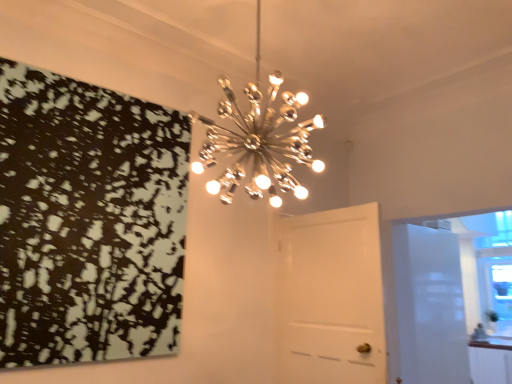
Question: From the image's perspective, is white glossy door at center, placed as the 1th door when sorted from front to back, positioned above or below white glossy cabinetry at lower right?

Choices:
 (A) below
 (B) above

Answer: (B)

Question: Considering the relative positions of white glossy door at center, the 2th door positioned from the back, and white glossy cabinetry at lower right in the image provided, is white glossy door at center, the 2th door positioned from the back, to the left or to the right of white glossy cabinetry at lower right?

Choices:
 (A) left
 (B) right

Answer: (A)

Question: Estimate the real-world distances between objects in this image. Which object is closer to the metallic starburst chandelier at upper center?

Choices:
 (A) white glossy door at center, the 2th door positioned from the back
 (B) black matte print at upper left
 (C) white glossy cabinetry at lower right
 (D) white glossy door at right, which is the first door in back-to-front order

Answer: (A)

Question: Estimate the real-world distances between objects in this image. Which object is closer to the white glossy door at center, the 1th door from the left?

Choices:
 (A) white glossy cabinetry at lower right
 (B) metallic starburst chandelier at upper center
 (C) black matte print at upper left
 (D) white glossy door at right, which appears as the 2th door when viewed from the left

Answer: (B)